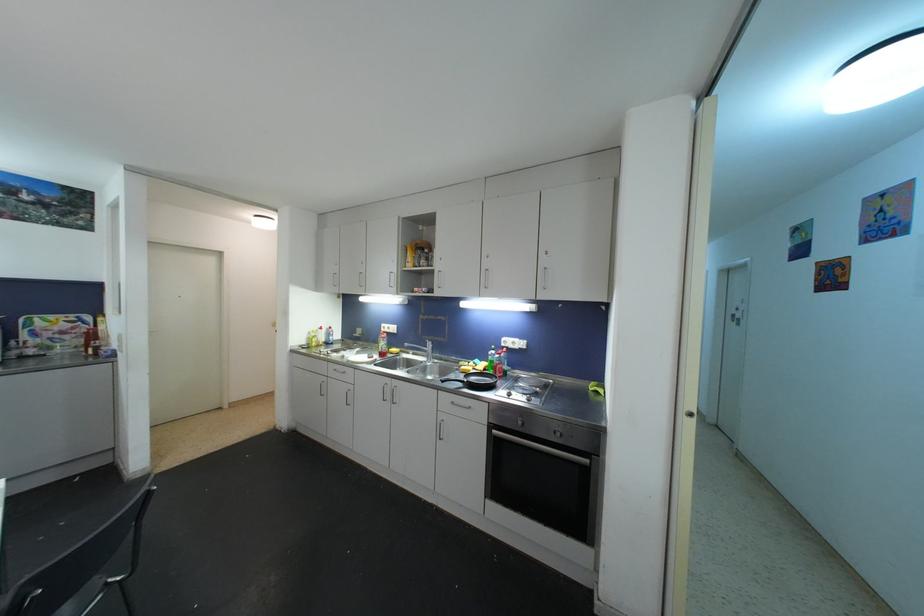
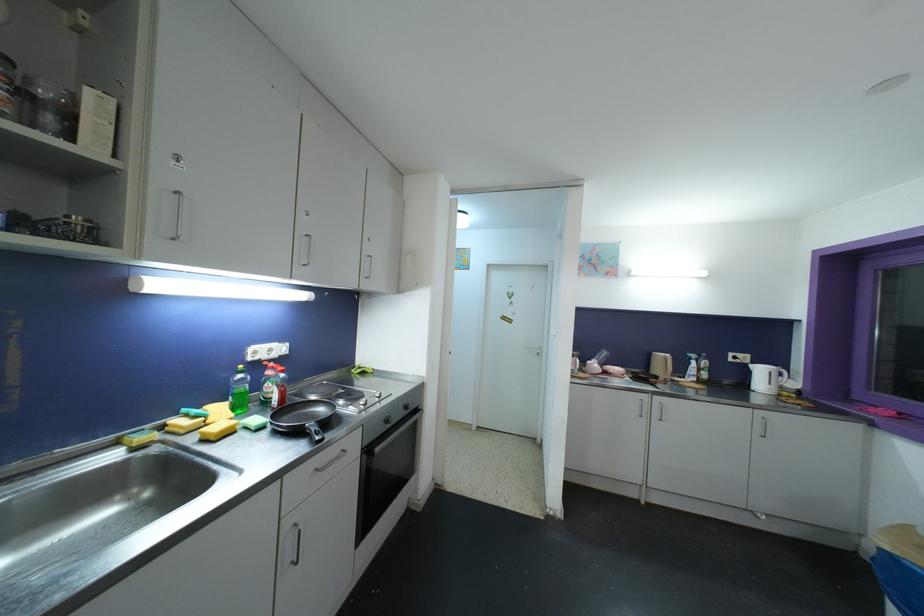
In the second image, find the point that corresponds to pixel 495 354 in the first image.

(244, 379)